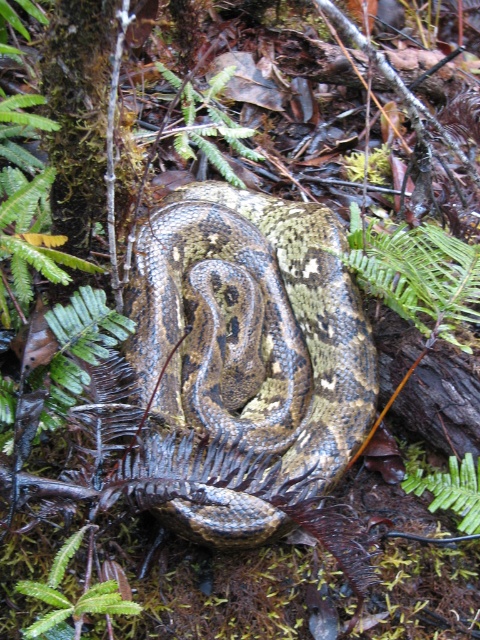
Question: Among these objects, which one is farthest from the camera?

Choices:
 (A) green leafy fern at upper center
 (B) green leafy fern at lower right

Answer: (A)

Question: Which of the following is the farthest from the observer?

Choices:
 (A) (470, 481)
 (B) (223, 160)
 (C) (404, 237)
 (D) (117, 588)

Answer: (B)

Question: Which point is farther to the camera?

Choices:
 (A) (95, 604)
 (B) (225, 364)
 (C) (197, 140)
 (D) (445, 273)

Answer: (C)

Question: Considering the relative positions of green leafy fern at center and green leafy fern at lower right in the image provided, where is green leafy fern at center located with respect to green leafy fern at lower right?

Choices:
 (A) above
 (B) below

Answer: (A)

Question: Is green leafy fern at center smaller than green fuzzy fern at lower left?

Choices:
 (A) yes
 (B) no

Answer: (B)

Question: Considering the relative positions of green leafy fern at upper center and green fuzzy fern at lower left in the image provided, where is green leafy fern at upper center located with respect to green fuzzy fern at lower left?

Choices:
 (A) below
 (B) above

Answer: (B)